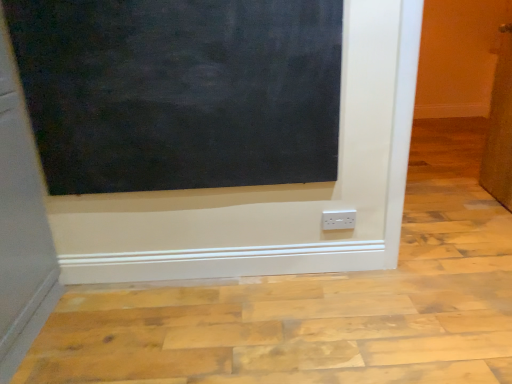
Question: Is white plastic power plugs and sockets at lower center inside or outside of brown textured door at right?

Choices:
 (A) outside
 (B) inside

Answer: (A)

Question: Considering the positions of white plastic power plugs and sockets at lower center and brown textured door at right in the image, is white plastic power plugs and sockets at lower center wider or thinner than brown textured door at right?

Choices:
 (A) wide
 (B) thin

Answer: (B)

Question: Which of these objects is positioned farthest from the white plastic power plugs and sockets at lower center?

Choices:
 (A) black matte board at upper left
 (B) brown textured door at right

Answer: (B)

Question: Estimate the real-world distances between objects in this image. Which object is farther from the brown textured door at right?

Choices:
 (A) white plastic power plugs and sockets at lower center
 (B) black matte board at upper left

Answer: (B)